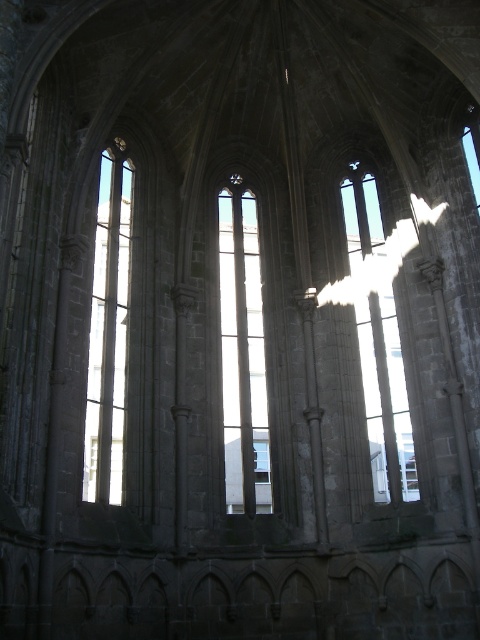
Question: Does clear glass window at center come behind transparent glass window at center?

Choices:
 (A) no
 (B) yes

Answer: (B)

Question: Which object is the closest to the clear glass window at center?

Choices:
 (A) transparent glass window at center
 (B) clear glass window at left

Answer: (A)

Question: Which of these objects is positioned farthest from the transparent glass window at center?

Choices:
 (A) clear glass window at left
 (B) clear glass window at center

Answer: (A)

Question: Is transparent glass window at center smaller than clear glass window at left?

Choices:
 (A) no
 (B) yes

Answer: (B)

Question: Among these points, which one is farthest from the camera?

Choices:
 (A) (238, 497)
 (B) (380, 444)
 (C) (123, 321)

Answer: (C)

Question: Is clear glass window at center to the right of clear glass window at left from the viewer's perspective?

Choices:
 (A) no
 (B) yes

Answer: (B)